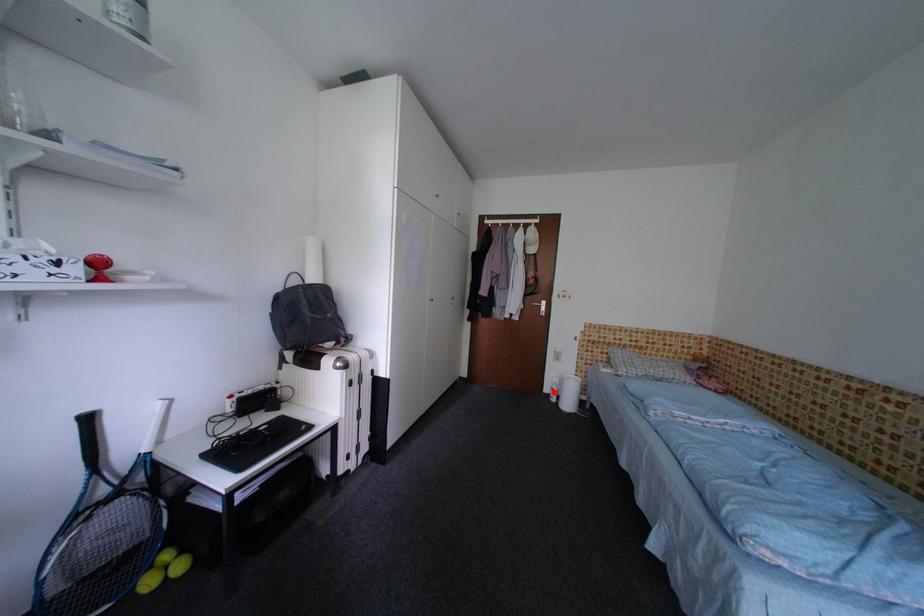
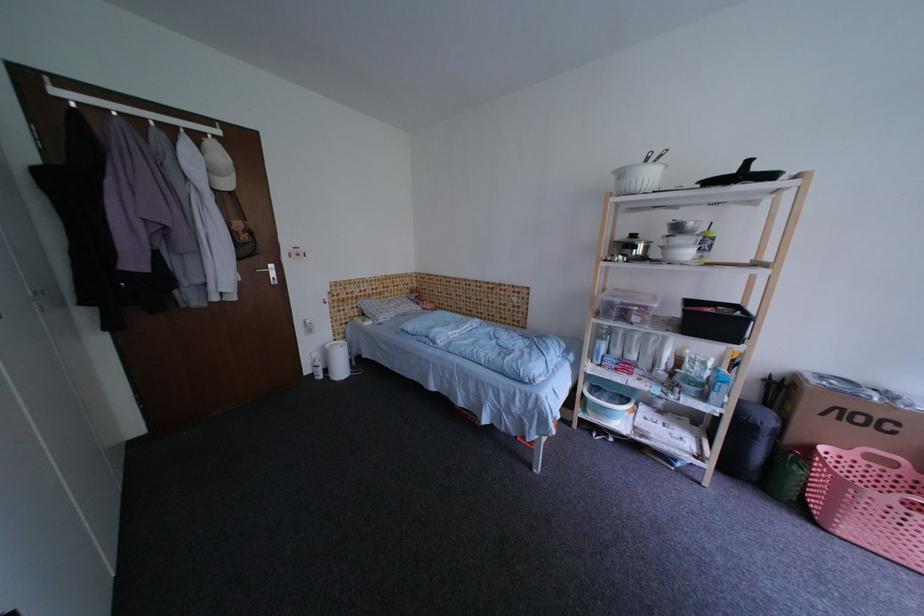
Question: I am providing you with two images of the same scene from different viewpoints. In image1, a red point is highlighted. Considering the same 3D point in image2, which of the following is correct?

Choices:
 (A) It is closer
 (B) It is farther

Answer: (A)